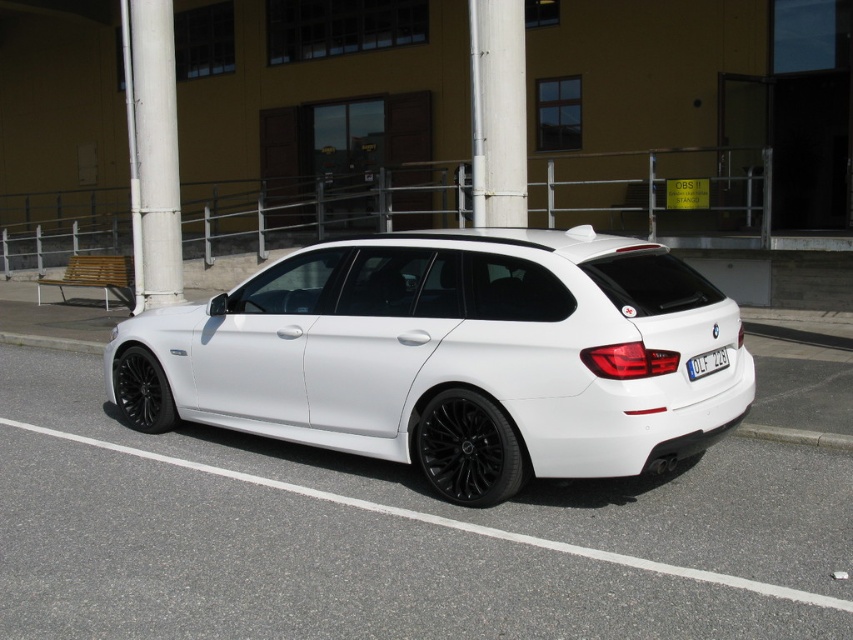
Does white glossy car at center have a lesser height compared to black matte wheel at lower left?

Yes, white glossy car at center is shorter than black matte wheel at lower left.

Consider the image. Does white glossy car at center appear on the left side of black matte wheel at lower left?

No, white glossy car at center is not to the left of black matte wheel at lower left.

Which is in front, point (248, 472) or point (154, 372)?

Positioned in front is point (248, 472).

At what (x,y) coordinates should I click in order to perform the action: click on white glossy car at center. Please return your answer as a coordinate pair (x, y). Image resolution: width=853 pixels, height=640 pixels. Looking at the image, I should click on (390, 538).

Who is more forward, (x=78, y=624) or (x=172, y=122)?

Point (x=78, y=624) is in front.

Does white glossy car at center appear under white painted metal pole at upper left?

Correct, white glossy car at center is located below white painted metal pole at upper left.

Who is more forward, (126, 506) or (132, 116)?

Positioned in front is point (126, 506).

At what (x,y) coordinates should I click in order to perform the action: click on white glossy car at center. Please return your answer as a coordinate pair (x, y). The width and height of the screenshot is (853, 640). Looking at the image, I should click on (390, 538).

Looking at this image, does white painted metal pole at upper left appear under white plastic license plate at center?

Incorrect, white painted metal pole at upper left is not positioned below white plastic license plate at center.

Between white painted metal pole at upper left and white plastic license plate at center, which one has more height?

With more height is white painted metal pole at upper left.

What do you see at coordinates (152, 150) in the screenshot? This screenshot has width=853, height=640. I see `white painted metal pole at upper left` at bounding box center [152, 150].

You are a GUI agent. You are given a task and a screenshot of the screen. Output one action in this format:
    pyautogui.click(x=<x>, y=<y>)
    Task: Click on the white painted metal pole at upper left
    This screenshot has height=640, width=853.
    Given the screenshot: What is the action you would take?
    pyautogui.click(x=152, y=150)